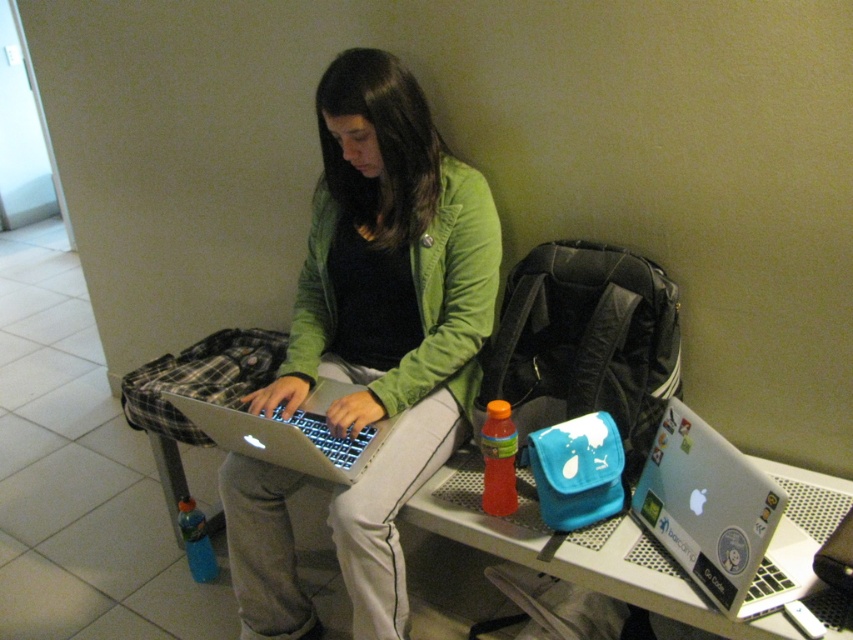
You are a photographer trying to capture the scene from a specific viewpoint. You want to ensure that the green matte jacket at center is in focus while avoiding the silver laptop on the bench next to them. Where should you position your camera relative to the point at coordinates (387, 308)?

Position the camera directly at the point at coordinates (387, 308) where the green matte jacket at center is located to ensure it is in focus while avoiding the silver laptop on the bench next to them.

Based on the photo, you are a tailor measuring garments for alterations. You need to determine if the green matte jacket at center can fit into a storage box designed to hold items up to the size of the silver metallic laptop at lower right. Based on their widths, will the jacket fit?

The green matte jacket at center is wider than the silver metallic laptop at lower right. Since the storage box is designed for items up to the laptop size, the jacket will not fit due to its greater width.